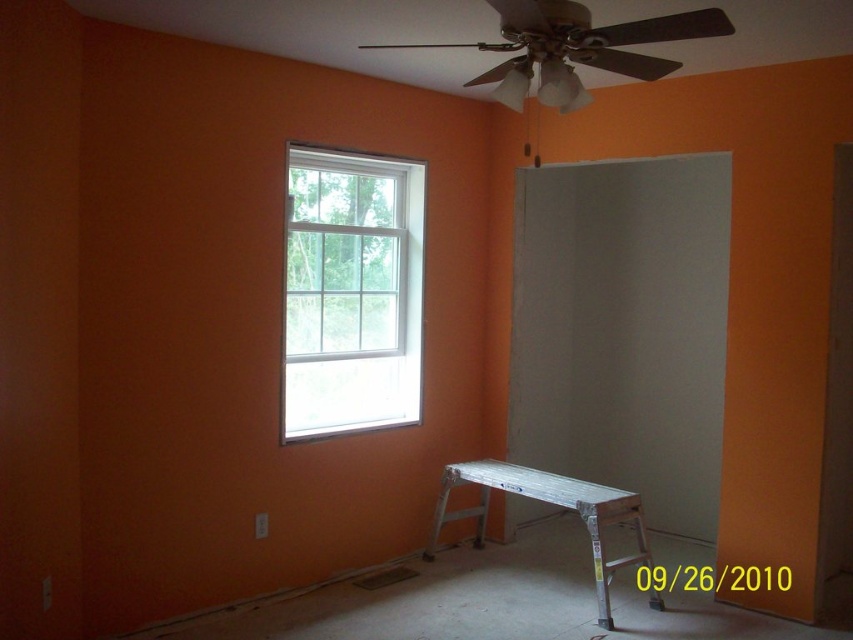
You are a painter holding a brush and standing in the room. You need to reach the window to clean it. The silver metallic stool at lower right is in your way. Can you move the stool to access the clear glass window at upper left?

The silver metallic stool at lower right is behind the clear glass window at upper left, so moving it would not block your access to the clear glass window at upper left. You can move the stool to reach the window.

You are a painter holding a 1.2 meter long paintbrush. You need to reach the top of the clear glass window at upper left without hitting the silver metallic stool at lower right. Is this possible?

The clear glass window at upper left is not as tall as the silver metallic stool at lower right, so the window is shorter. Since the paintbrush is 1.2 meters long, you can extend it upwards beyond the stool to reach the window top without obstruction.